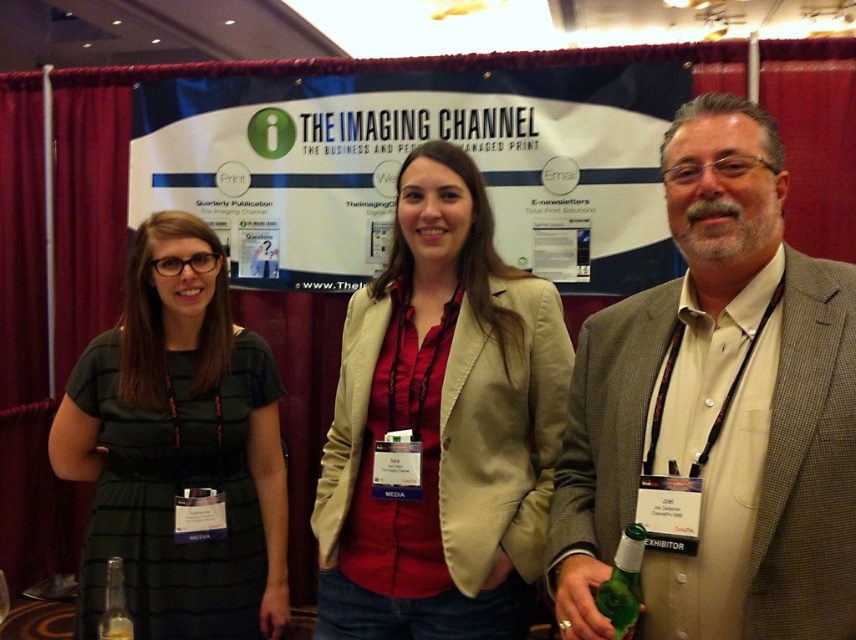
Can you confirm if dark green dress at left is taller than clear glass bottle at lower left?

Yes, dark green dress at left is taller than clear glass bottle at lower left.

Is dark green dress at left above clear glass bottle at lower left?

Yes, dark green dress at left is above clear glass bottle at lower left.

Measure the distance between point [116,445] and camera.

The distance of point [116,445] from camera is 5.58 feet.

Image resolution: width=856 pixels, height=640 pixels. In order to click on dark green dress at left in this screenshot , I will do `click(177, 448)`.

Can you confirm if dark green dress at left is positioned below green glass bottle at lower right?

Actually, dark green dress at left is above green glass bottle at lower right.

Does dark green dress at left appear on the left side of green glass bottle at lower right?

Indeed, dark green dress at left is positioned on the left side of green glass bottle at lower right.

Is point (79, 588) positioned behind point (622, 540)?

Yes.

At what (x,y) coordinates should I click in order to perform the action: click on dark green dress at left. Please return your answer as a coordinate pair (x, y). Image resolution: width=856 pixels, height=640 pixels. Looking at the image, I should click on (177, 448).

Can you confirm if brown textured blazer at center is thinner than dark green dress at left?

Yes.

Is the position of brown textured blazer at center more distant than that of dark green dress at left?

No, it is not.

Is point (841, 324) positioned in front of point (283, 579)?

Yes.

Locate an element on the screen. The height and width of the screenshot is (640, 856). brown textured blazer at center is located at coordinates (718, 408).